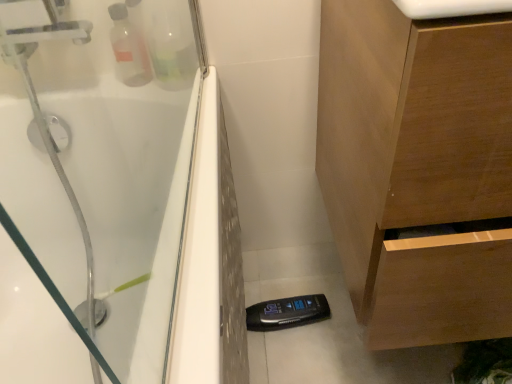
Question: From the image's perspective, is white glossy sink at upper center under wooden cabinet at lower right?

Choices:
 (A) yes
 (B) no

Answer: (B)

Question: Considering the relative sizes of white glossy sink at upper center and wooden cabinet at lower right in the image provided, is white glossy sink at upper center taller than wooden cabinet at lower right?

Choices:
 (A) no
 (B) yes

Answer: (A)

Question: From a real-world perspective, is white glossy sink at upper center over wooden cabinet at lower right?

Choices:
 (A) no
 (B) yes

Answer: (B)

Question: From a real-world perspective, is white glossy sink at upper center under wooden cabinet at lower right?

Choices:
 (A) no
 (B) yes

Answer: (A)

Question: Is white glossy sink at upper center beside wooden cabinet at lower right?

Choices:
 (A) no
 (B) yes

Answer: (A)

Question: Does white glossy sink at upper center appear on the left side of wooden cabinet at lower right?

Choices:
 (A) yes
 (B) no

Answer: (A)

Question: Does wooden cabinet at lower right appear on the left side of white glossy sink at upper center?

Choices:
 (A) yes
 (B) no

Answer: (B)

Question: Does wooden cabinet at lower right turn towards white glossy sink at upper center?

Choices:
 (A) no
 (B) yes

Answer: (A)

Question: Is wooden cabinet at lower right located outside white glossy sink at upper center?

Choices:
 (A) no
 (B) yes

Answer: (B)

Question: Considering the relative sizes of wooden cabinet at lower right and white glossy sink at upper center in the image provided, is wooden cabinet at lower right bigger than white glossy sink at upper center?

Choices:
 (A) no
 (B) yes

Answer: (B)

Question: From the image's perspective, is wooden cabinet at lower right located beneath white glossy sink at upper center?

Choices:
 (A) no
 (B) yes

Answer: (B)

Question: From a real-world perspective, is wooden cabinet at lower right under white glossy sink at upper center?

Choices:
 (A) no
 (B) yes

Answer: (B)

Question: In the image, is white glossy sink at upper center on the left side or the right side of wooden cabinet at lower right?

Choices:
 (A) right
 (B) left

Answer: (B)